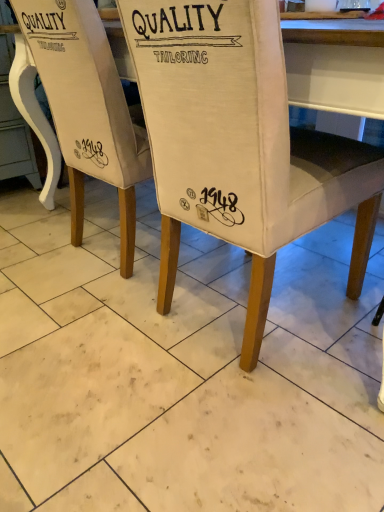
Locate an element on the screen. Image resolution: width=384 pixels, height=512 pixels. vacant space situated on the left part of canvas chair at center, arranged as the second chair when viewed from the right is located at coordinates (32, 246).